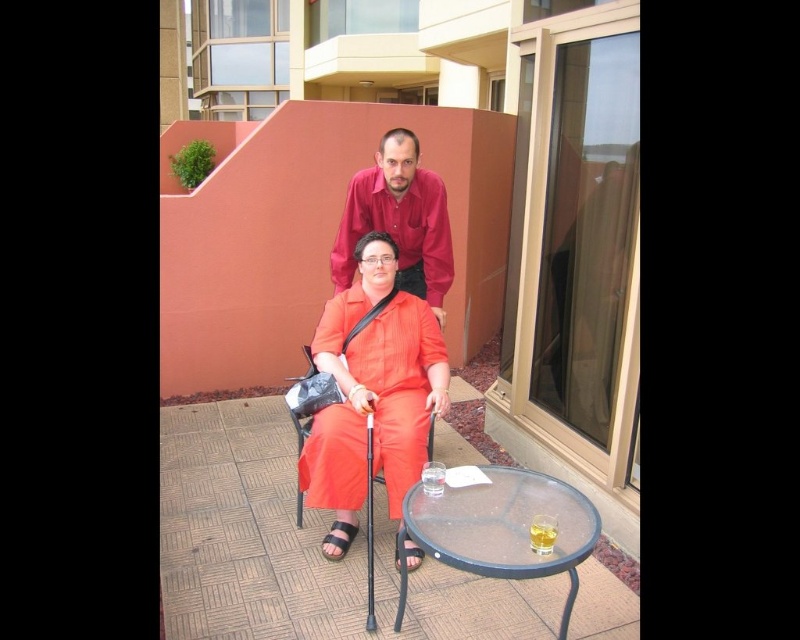
You are a delivery person trying to place a package on the transparent glass table at lower center. The package is as wide as the matte orange jumpsuit at center. Will the package fit on the table?

The matte orange jumpsuit at center is narrower than the transparent glass table at lower center, so the package, being as wide as the matte orange jumpsuit at center, will fit on the table.

You are a delivery person who needs to place a package between the matte red shirt at upper center and the matte orange fabric chair at center. The package is 30 inches long. Can you fit it between them?

The distance between the matte red shirt at upper center and the matte orange fabric chair at center is 28.00 inches. Since the package is 30 inches long, it cannot fit in the space between them.

Looking at this image, you are a delivery person who needs to place a package between the matte red shirt at upper center and the matte orange fabric chair at center. Can you fit the package there?

The matte red shirt at upper center is located above the matte orange fabric chair at center, so there is no space between them for the package. You need to choose another location.